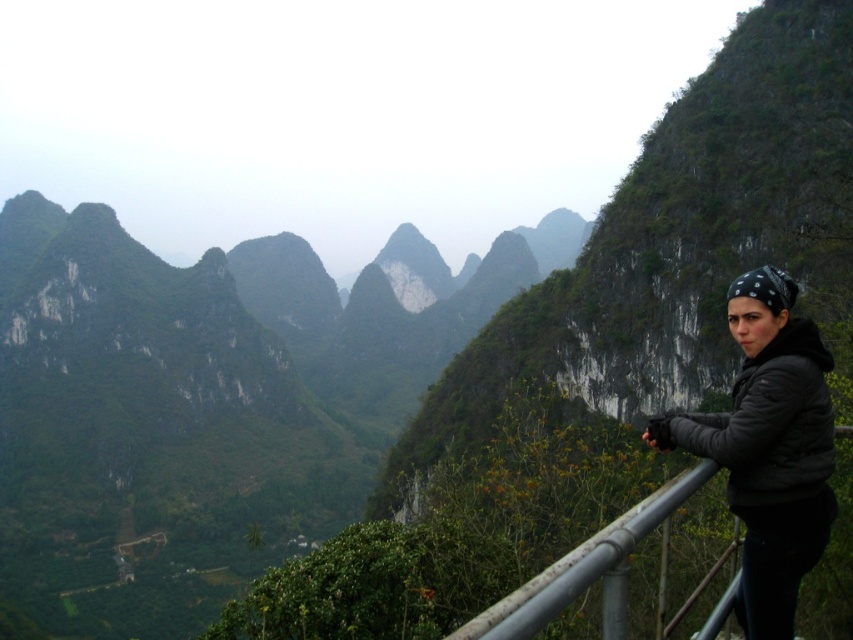
Between black matte jacket at right and rusty metal railing at lower right, which one is positioned lower?

Positioned lower is rusty metal railing at lower right.

Can you confirm if black matte jacket at right is positioned above rusty metal railing at lower right?

Correct, black matte jacket at right is located above rusty metal railing at lower right.

Which is behind, point (752, 588) or point (492, 630)?

Point (752, 588)

This screenshot has width=853, height=640. I want to click on black matte jacket at right, so click(x=769, y=448).